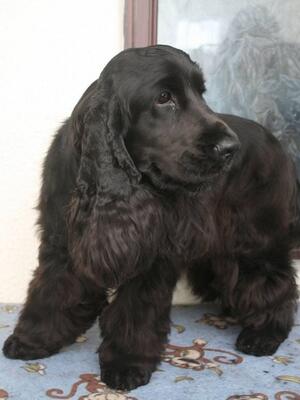
Locate an element on the screen. The height and width of the screenshot is (400, 300). frame is located at coordinates (143, 25).